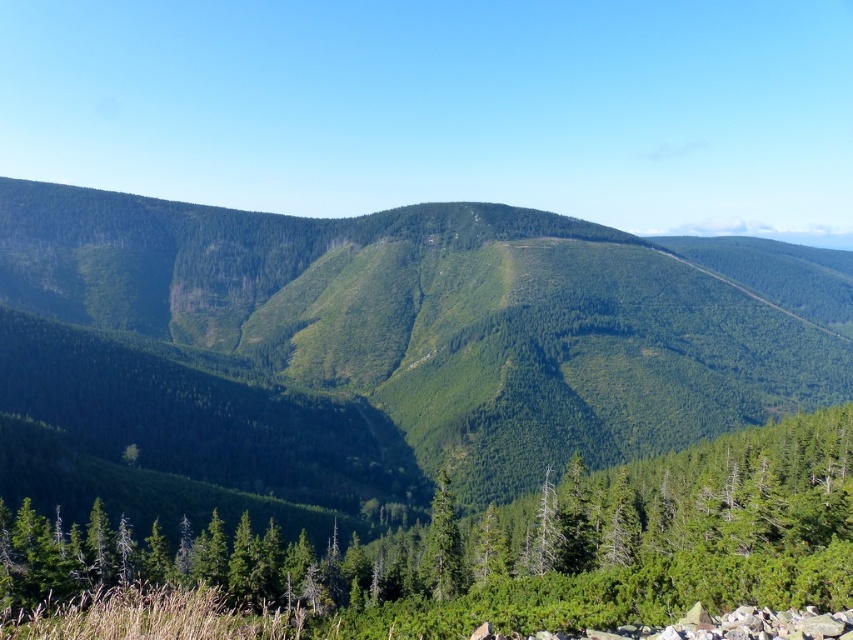
Between point (227, 381) and point (427, 536), which one is positioned behind?

Positioned behind is point (227, 381).

Based on the photo, which is above, green forested mountain at center or green matte tree at center?

green forested mountain at center is above.

Is point (347, 506) positioned in front of point (444, 532)?

That is False.

The height and width of the screenshot is (640, 853). I want to click on green forested mountain at center, so click(x=398, y=340).

Can you confirm if green forested mountain at center is positioned to the left of green matte tree at lower center?

In fact, green forested mountain at center is to the right of green matte tree at lower center.

What do you see at coordinates (398, 340) in the screenshot? The height and width of the screenshot is (640, 853). I see `green forested mountain at center` at bounding box center [398, 340].

You are a GUI agent. You are given a task and a screenshot of the screen. Output one action in this format:
    pyautogui.click(x=<x>, y=<y>)
    Task: Click on the green forested mountain at center
    This screenshot has width=853, height=640.
    Given the screenshot: What is the action you would take?
    pyautogui.click(x=398, y=340)

Measure the distance between green matte tree at lower center and camera.

green matte tree at lower center and camera are 60.19 feet apart from each other.

Can you confirm if green matte tree at lower center is taller than green matte tree at center?

Yes.

Find the location of a particular element. Image resolution: width=853 pixels, height=640 pixels. green matte tree at lower center is located at coordinates (508, 548).